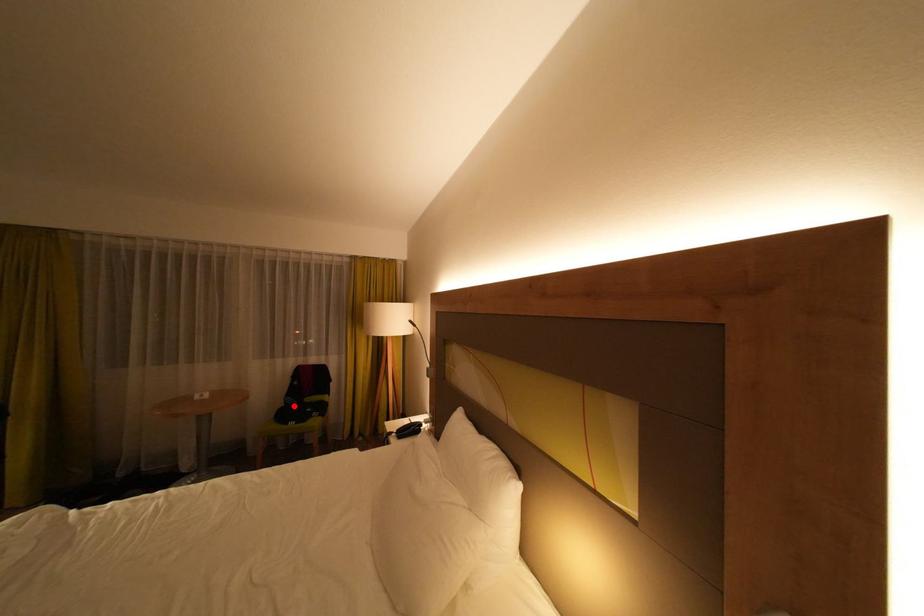
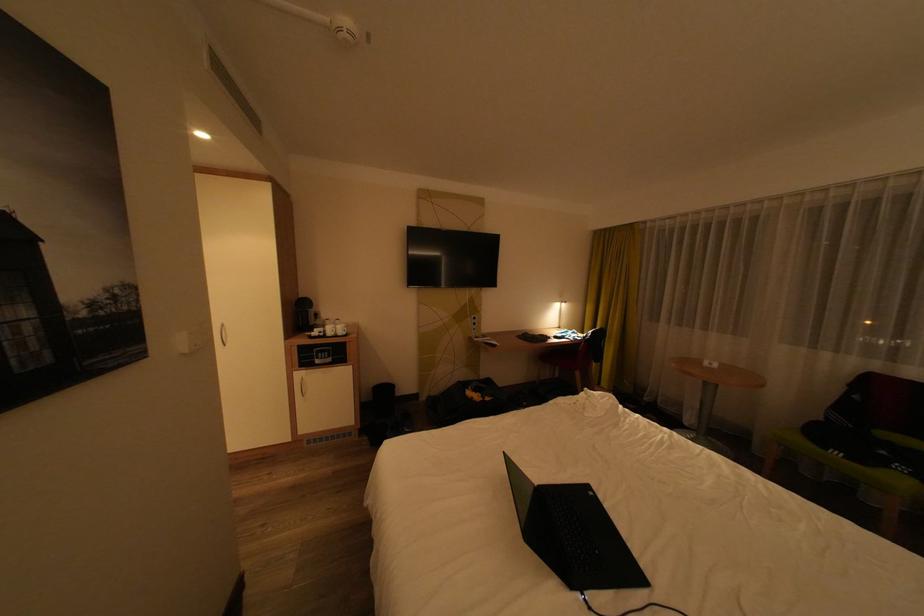
Where in the second image is the point corresponding to the highlighted location from the first image?

(833, 419)